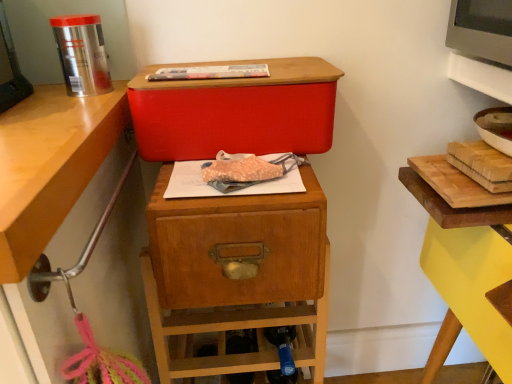
The width and height of the screenshot is (512, 384). What do you see at coordinates (236, 275) in the screenshot?
I see `wooden drawer at center` at bounding box center [236, 275].

At what (x,y) coordinates should I click in order to perform the action: click on matte plastic baguette at center. Please return your answer as a coordinate pair (x, y). The width and height of the screenshot is (512, 384). Looking at the image, I should click on (211, 72).

At what (x,y) coordinates should I click in order to perform the action: click on wooden drawer at center. Please return your answer as a coordinate pair (x, y). The height and width of the screenshot is (384, 512). Looking at the image, I should click on (236, 275).

From their relative heights in the image, would you say matte plastic baguette at center is taller or shorter than wooden drawer at center?

In the image, matte plastic baguette at center appears to be shorter than wooden drawer at center.

Are matte plastic baguette at center and wooden drawer at center making contact?

No, matte plastic baguette at center is not in contact with wooden drawer at center.

Is matte plastic baguette at center spatially inside wooden drawer at center, or outside of it?

matte plastic baguette at center is outside wooden drawer at center.

Considering the positions of point (170, 75) and point (217, 239), is point (170, 75) closer or farther from the camera than point (217, 239)?

Clearly, point (170, 75) is more distant from the camera than point (217, 239).

Between wooden drawer at center and matte plastic baguette at center, which one has larger size?

With larger size is wooden drawer at center.

Is wooden drawer at center beside matte plastic baguette at center?

No, wooden drawer at center is not next to matte plastic baguette at center.

In terms of height, does wooden drawer at center look taller or shorter compared to matte plastic baguette at center?

wooden drawer at center is taller than matte plastic baguette at center.

Considering the sizes of objects wooden drawer at center and matte plastic baguette at center in the image provided, who is thinner, wooden drawer at center or matte plastic baguette at center?

matte plastic baguette at center is thinner.

Are wooden drawer at center and matte red storage box at center far apart?

No.

This screenshot has height=384, width=512. Identify the location of storage box in front of the wooden drawer at center. (236, 112).

From the image's perspective, is wooden drawer at center below matte red storage box at center?

Yes.

Considering the relative sizes of wooden drawer at center and matte red storage box at center in the image provided, is wooden drawer at center wider than matte red storage box at center?

Correct, the width of wooden drawer at center exceeds that of matte red storage box at center.

Consider the image. Is matte red storage box at center bigger or smaller than wooden drawer at center?

In the image, matte red storage box at center appears to be smaller than wooden drawer at center.

From a real-world perspective, between matte red storage box at center and wooden drawer at center, who is vertically lower?

wooden drawer at center, from a real-world perspective.

Is matte red storage box at center far away from wooden drawer at center?

No, there isn't a large distance between matte red storage box at center and wooden drawer at center.

Consider the image. Is matte red storage box at center outside of wooden drawer at center?

Indeed, matte red storage box at center is completely outside wooden drawer at center.

From the image's perspective, is matte red storage box at center on matte plastic baguette at center?

No, from the image's perspective, matte red storage box at center is not on top of matte plastic baguette at center.

Considering the sizes of matte red storage box at center and matte plastic baguette at center in the image, is matte red storage box at center bigger or smaller than matte plastic baguette at center?

In the image, matte red storage box at center appears to be larger than matte plastic baguette at center.

Is matte plastic baguette at center completely or partially inside matte red storage box at center?

No, matte plastic baguette at center is not inside matte red storage box at center.

Considering the sizes of objects matte plastic baguette at center and matte red storage box at center in the image provided, who is thinner, matte plastic baguette at center or matte red storage box at center?

matte plastic baguette at center is thinner.

Could you tell me if matte plastic baguette at center is turned towards matte red storage box at center?

No, matte plastic baguette at center is not aimed at matte red storage box at center.

Would you say matte plastic baguette at center is inside or outside matte red storage box at center?

matte plastic baguette at center is spatially situated outside matte red storage box at center.

Does matte plastic baguette at center have a smaller size compared to matte red storage box at center?

Indeed, matte plastic baguette at center has a smaller size compared to matte red storage box at center.

Locate an element on the screen. This screenshot has height=384, width=512. food above the wooden drawer at center (from a real-world perspective) is located at coordinates (211, 72).

Where is `nightstand below the matte plastic baguette at center (from a real-world perspective)`? This screenshot has height=384, width=512. nightstand below the matte plastic baguette at center (from a real-world perspective) is located at coordinates click(x=236, y=275).

Estimate the real-world distances between objects in this image. Which object is closer to matte plastic baguette at center, wooden drawer at center or matte red storage box at center?

Based on the image, matte red storage box at center appears to be nearer to matte plastic baguette at center.

Based on the photo, based on their spatial positions, is wooden drawer at center or matte plastic baguette at center closer to matte red storage box at center?

Among the two, matte plastic baguette at center is located nearer to matte red storage box at center.

Based on their spatial positions, is matte plastic baguette at center or matte red storage box at center further from wooden drawer at center?

matte plastic baguette at center is further to wooden drawer at center.

Based on the photo, which object lies further to the anchor point wooden drawer at center, matte red storage box at center or matte plastic baguette at center?

matte plastic baguette at center.

Estimate the real-world distances between objects in this image. Which object is further from matte red storage box at center, matte plastic baguette at center or wooden drawer at center?

Among the two, wooden drawer at center is located further to matte red storage box at center.

Which object lies nearer to the anchor point matte plastic baguette at center, matte red storage box at center or wooden drawer at center?

The object closer to matte plastic baguette at center is matte red storage box at center.

This screenshot has width=512, height=384. I want to click on storage box between matte plastic baguette at center and wooden drawer at center in the up-down direction, so click(x=236, y=112).